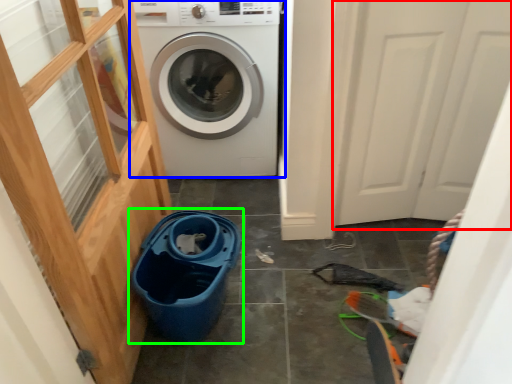
Question: Based on their relative distances, which object is farther from screen door (highlighted by a red box)? Choose from washing machine (highlighted by a blue box) and recycling bin (highlighted by a green box).

Choices:
 (A) washing machine
 (B) recycling bin

Answer: (B)